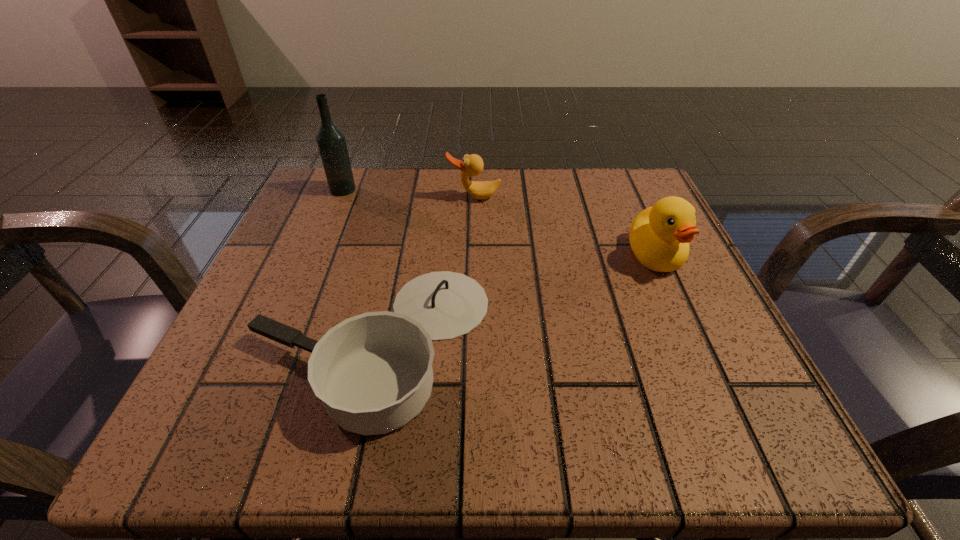
Locate an element on the screen. Image resolution: width=960 pixels, height=540 pixels. vodka at the far edge is located at coordinates (331, 141).

Find the location of a particular element. The height and width of the screenshot is (540, 960). duck positioned at the far edge is located at coordinates (472, 165).

Locate an element on the screen. object located at the near edge is located at coordinates (373, 372).

You are a GUI agent. You are given a task and a screenshot of the screen. Output one action in this format:
    pyautogui.click(x=<x>, y=<y>)
    Task: Click on the vodka that is positioned at the left edge
    The image size is (960, 540).
    Given the screenshot: What is the action you would take?
    pyautogui.click(x=331, y=141)

Locate an element on the screen. The width and height of the screenshot is (960, 540). saucepan that is at the left edge is located at coordinates (373, 372).

At what (x,y) coordinates should I click in order to perform the action: click on object that is at the right edge. Please return your answer as a coordinate pair (x, y). This screenshot has width=960, height=540. Looking at the image, I should click on (659, 236).

The width and height of the screenshot is (960, 540). I want to click on object that is at the far left corner, so click(331, 141).

The image size is (960, 540). I want to click on object that is at the near left corner, so click(373, 372).

Where is `free space at the far edge of the desktop`? Image resolution: width=960 pixels, height=540 pixels. free space at the far edge of the desktop is located at coordinates (386, 211).

The height and width of the screenshot is (540, 960). In the image, there is a desktop. What are the coordinates of `vacant area at the near edge` in the screenshot? It's located at (562, 401).